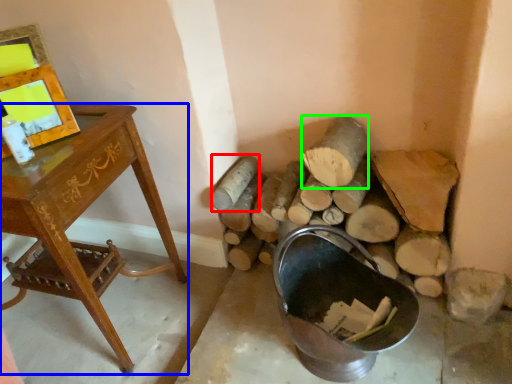
Question: Based on their relative distances, which object is nearer to log (highlighted by a red box)? Choose from desk (highlighted by a blue box) and log (highlighted by a green box).

Choices:
 (A) desk
 (B) log

Answer: (B)